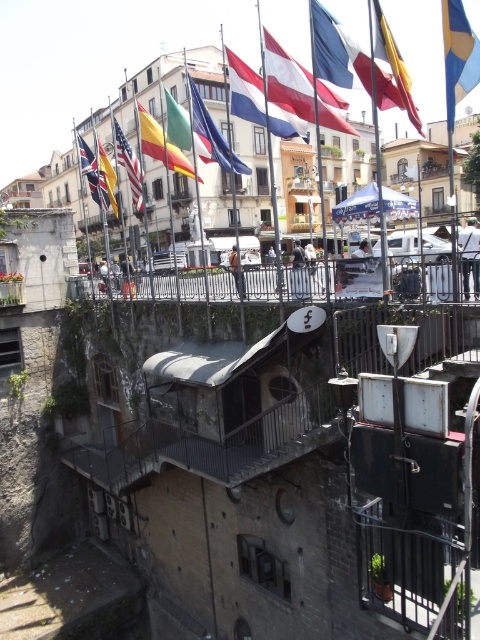
Between blue fabric flag at upper right and green fabric flag at upper center, which one is positioned higher?

Positioned higher is blue fabric flag at upper right.

Is blue fabric flag at upper right above green fabric flag at upper center?

Indeed, blue fabric flag at upper right is positioned over green fabric flag at upper center.

Describe the element at coordinates (457, 54) in the screenshot. The width and height of the screenshot is (480, 640). I see `blue fabric flag at upper right` at that location.

Where is `blue fabric flag at upper right`? Image resolution: width=480 pixels, height=640 pixels. blue fabric flag at upper right is located at coordinates (457, 54).

In order to click on yellow and blue striped flag at upper right in this screenshot , I will do `click(395, 64)`.

Is yellow and blue striped flag at upper right thinner than matte black flag at upper left?

Incorrect, yellow and blue striped flag at upper right's width is not less than matte black flag at upper left's.

Where is `yellow and blue striped flag at upper right`? The height and width of the screenshot is (640, 480). yellow and blue striped flag at upper right is located at coordinates (395, 64).

Is red-white-blue fabric flag at center bigger than red and white striped flag at upper center?

Actually, red-white-blue fabric flag at center might be smaller than red and white striped flag at upper center.

Between point (282, 68) and point (242, 109), which one is positioned in front?

Point (282, 68)

Who is more forward, [339,129] or [255,116]?

Point [339,129] is in front.

Locate an element on the screen. red-white-blue fabric flag at center is located at coordinates (288, 81).